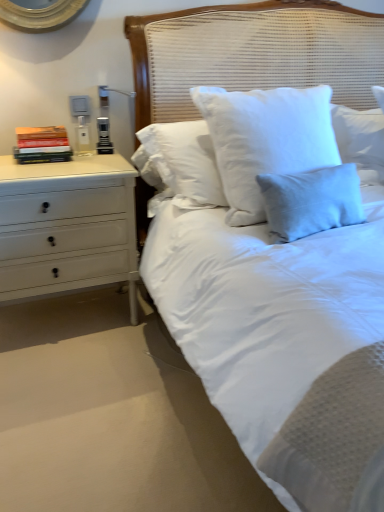
Find the location of `free spot to the right of hardcover books at left`. free spot to the right of hardcover books at left is located at coordinates (97, 161).